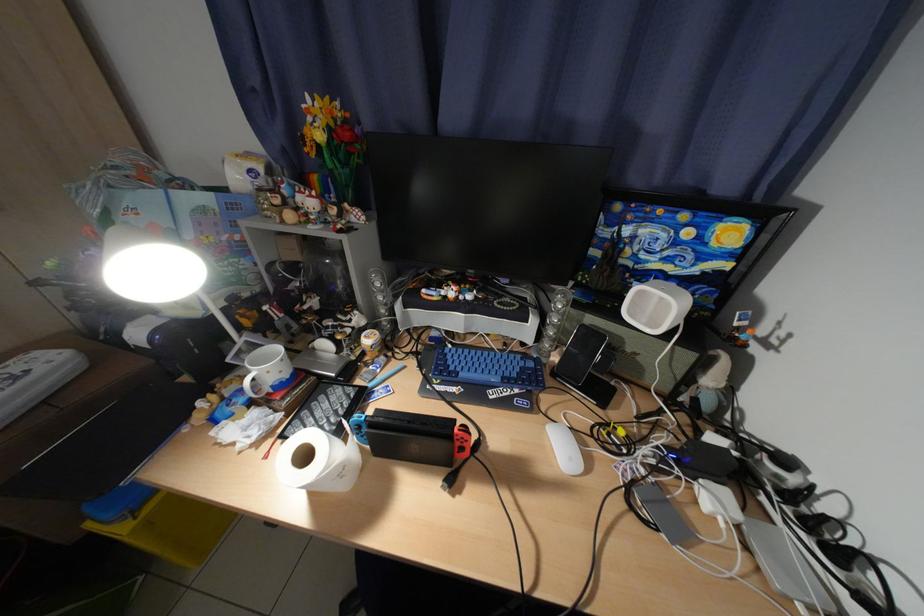
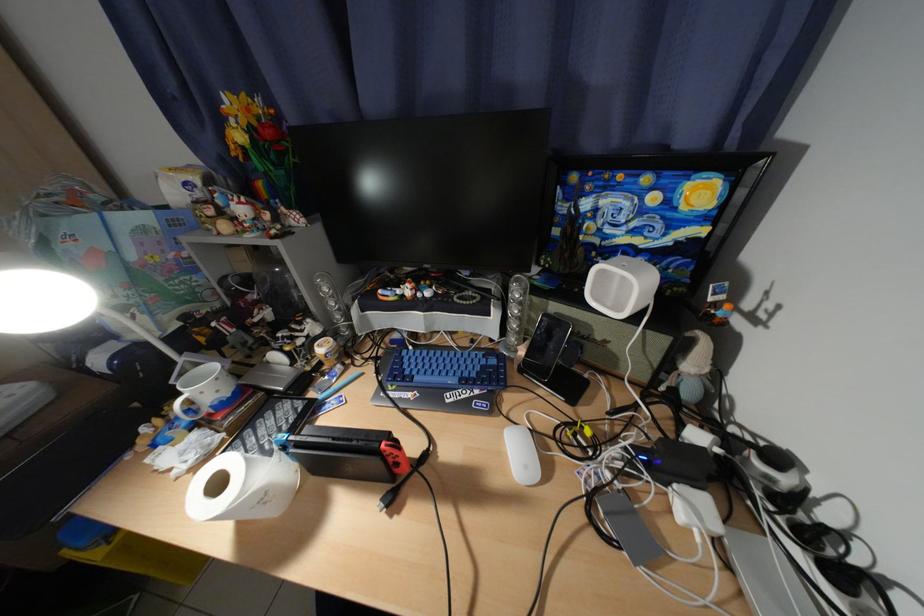
In the second image, find the point that corresponds to [315,458] in the first image.

(229, 485)